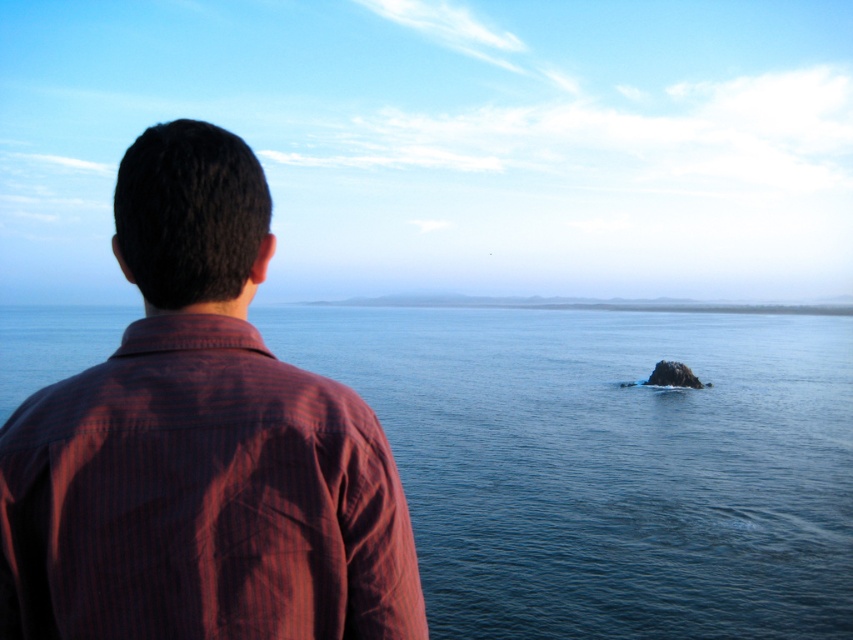
Question: Which point is farther to the camera?

Choices:
 (A) striped cotton shirt at upper left
 (B) blue water at center

Answer: (B)

Question: Does blue water at center have a larger size compared to striped cotton shirt at upper left?

Choices:
 (A) no
 (B) yes

Answer: (B)

Question: Is blue water at center closer to camera compared to striped cotton shirt at upper left?

Choices:
 (A) yes
 (B) no

Answer: (B)

Question: Is blue water at center above striped cotton shirt at upper left?

Choices:
 (A) no
 (B) yes

Answer: (B)

Question: Among these objects, which one is nearest to the camera?

Choices:
 (A) striped cotton shirt at upper left
 (B) blue water at center

Answer: (A)